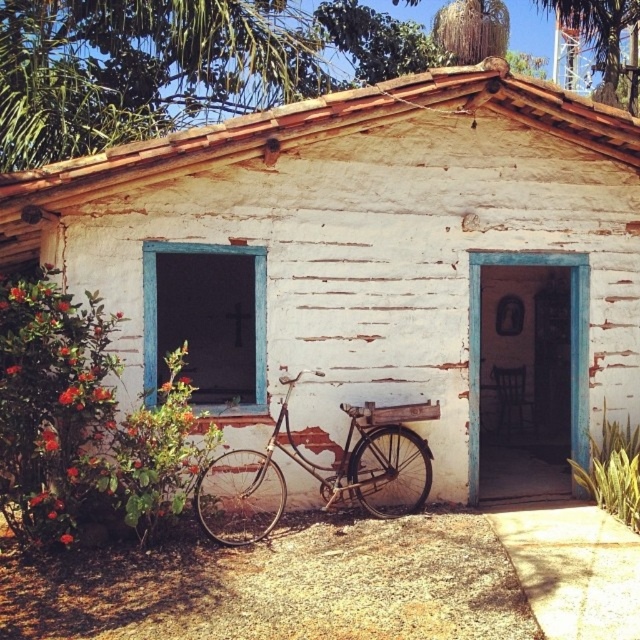
Describe the element at coordinates (362, 250) in the screenshot. I see `white weathered wood hut at center` at that location.

Measure the distance between white weathered wood hut at center and rusty metal bicycle at lower left.

white weathered wood hut at center is 5.44 meters from rusty metal bicycle at lower left.

Who is more forward, (580, 252) or (410, 508)?

Point (410, 508) is more forward.

You are a GUI agent. You are given a task and a screenshot of the screen. Output one action in this format:
    pyautogui.click(x=<x>, y=<y>)
    Task: Click on the white weathered wood hut at center
    Image resolution: width=640 pixels, height=640 pixels.
    Given the screenshot: What is the action you would take?
    tap(362, 250)